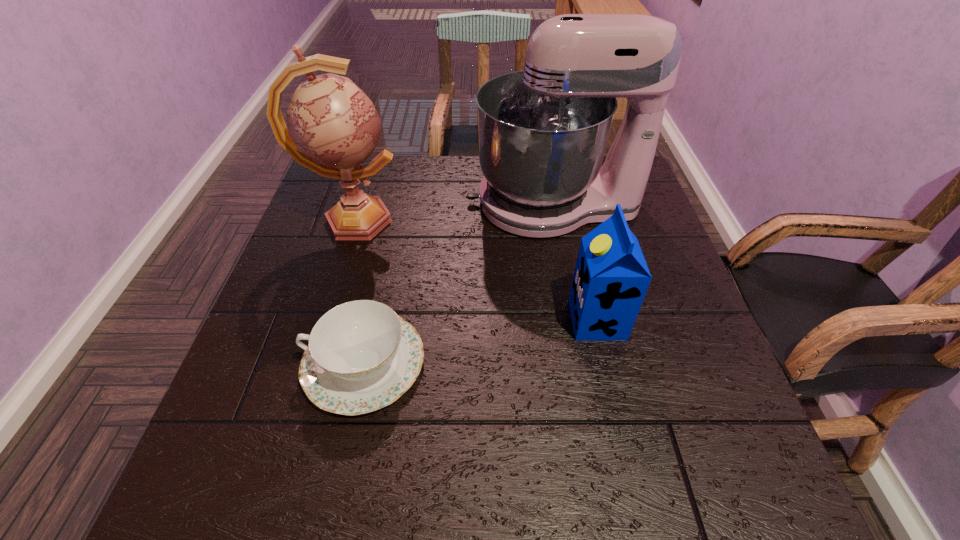
Where is `object present at the far right corner`? This screenshot has width=960, height=540. object present at the far right corner is located at coordinates (542, 132).

At what (x,y) coordinates should I click in order to perform the action: click on free space at the far edge of the desktop. Please return your answer as a coordinate pair (x, y). This screenshot has height=540, width=960. Looking at the image, I should click on (396, 204).

I want to click on vacant space at the near edge, so click(x=544, y=469).

I want to click on vacant space at the left edge of the desktop, so click(x=302, y=266).

Locate an element on the screen. empty space between the third tallest object and the chinaware is located at coordinates (481, 341).

The height and width of the screenshot is (540, 960). What are the coordinates of `free space between the mixer and the globe` in the screenshot? It's located at (453, 212).

Find the location of a particular element. free space between the carton and the mixer is located at coordinates (575, 262).

Locate an element on the screen. free space between the globe and the mixer is located at coordinates (453, 212).

You are a GUI agent. You are given a task and a screenshot of the screen. Output one action in this format:
    pyautogui.click(x=<x>, y=<y>)
    Task: Click on the vacant space that is in between the third tallest object and the shortest object
    Image resolution: width=960 pixels, height=540 pixels.
    Given the screenshot: What is the action you would take?
    pyautogui.click(x=481, y=341)

Where is `free space between the globe and the chinaware`? The width and height of the screenshot is (960, 540). free space between the globe and the chinaware is located at coordinates (359, 292).